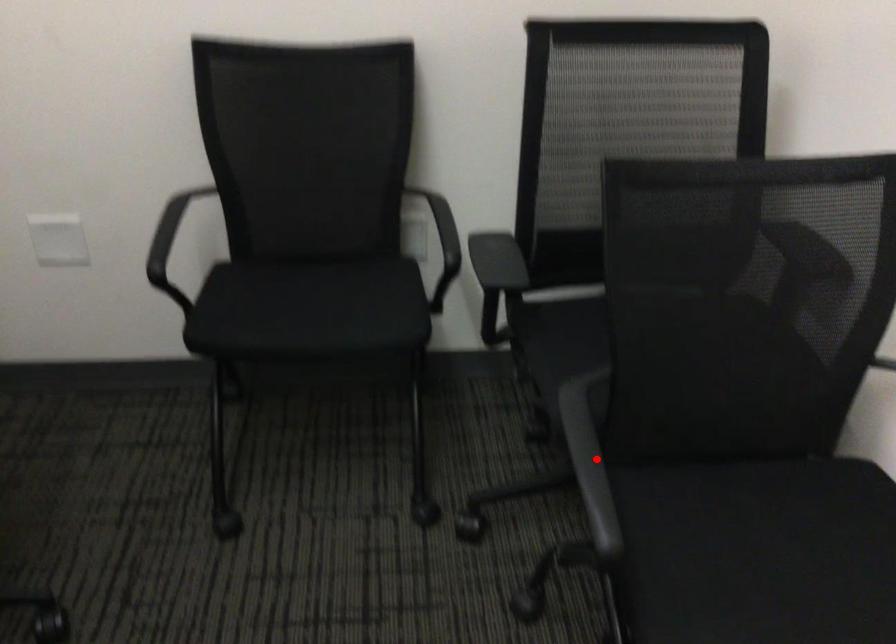
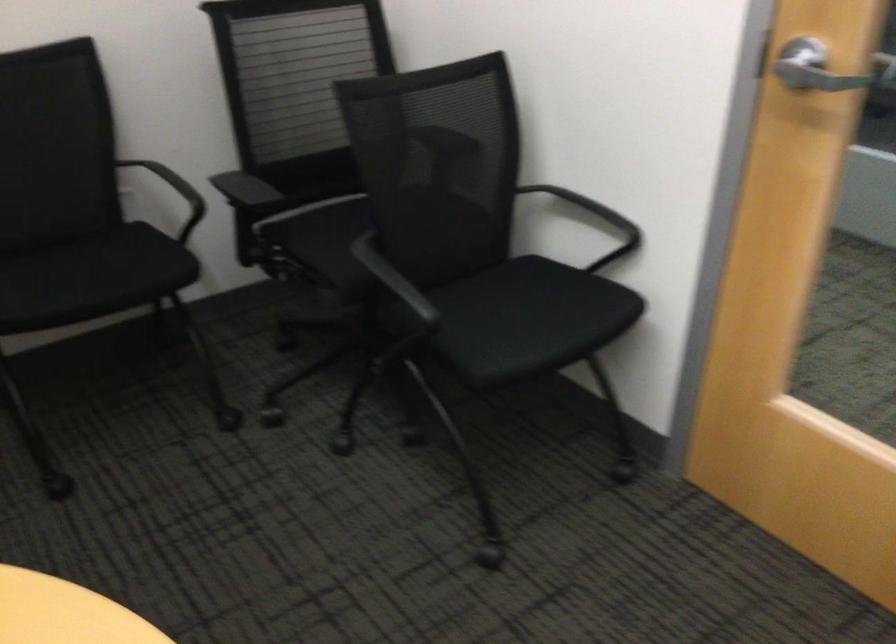
Question: I am providing you with two images of the same scene from different viewpoints. A red point is shown in image1. For the corresponding object point in image2, is it positioned nearer or farther from the camera?

Choices:
 (A) Nearer
 (B) Farther

Answer: (B)